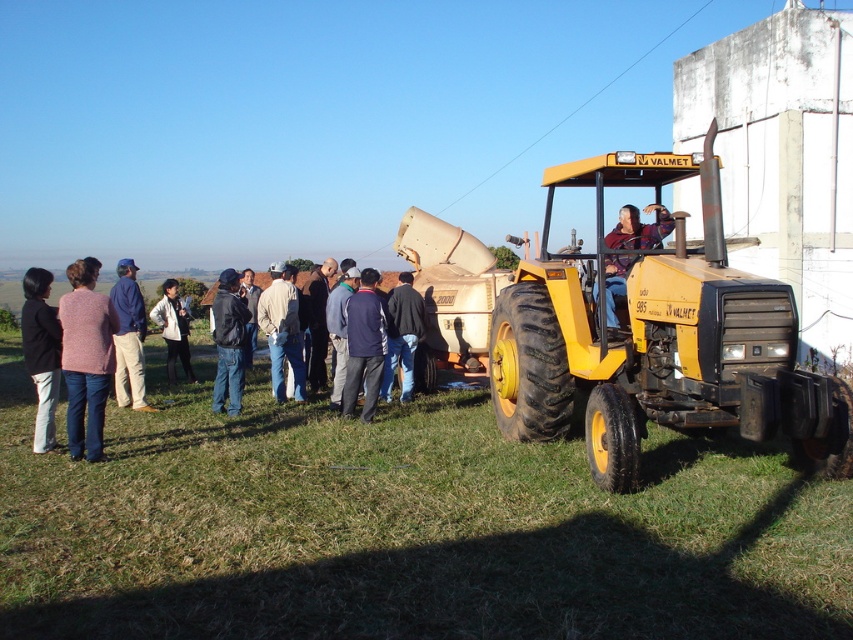
Question: Based on their relative distances, which object is farther from the yellow matte tractor at right?

Choices:
 (A) light brown jacket at center
 (B) green grass at lower center

Answer: (A)

Question: Is dark gray jacket at left to the right of dark blue fabric jacket at center from the viewer's perspective?

Choices:
 (A) no
 (B) yes

Answer: (A)

Question: Can you confirm if yellow matte tractor at right is smaller than navy blue jacket at center?

Choices:
 (A) no
 (B) yes

Answer: (A)

Question: Which of these objects is positioned closest to the knitted pink sweater at left?

Choices:
 (A) matte black jacket at center
 (B) blue denim jeans at left
 (C) dark blue jeans at center

Answer: (B)

Question: Which point is farther from the camera taking this photo?

Choices:
 (A) (445, 291)
 (B) (38, 440)

Answer: (A)

Question: Does dark gray jacket at left have a smaller size compared to blue denim jeans at left?

Choices:
 (A) yes
 (B) no

Answer: (A)